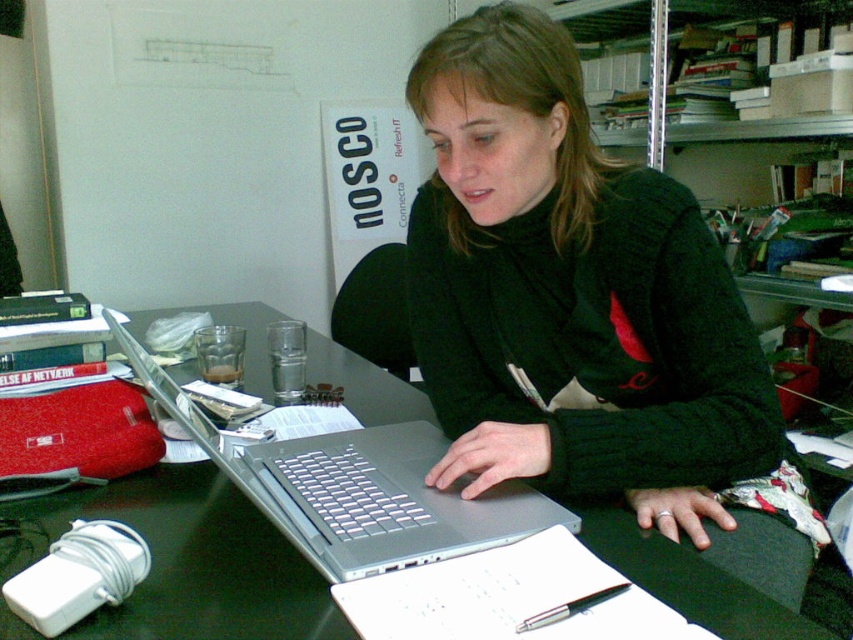
Please provide the coordinates of the metallic gray table at center in the image. The coordinates should be in the format of a point with two decimal places, like this example format. Please ensure your answer strictly follows the format without any additional text or explanation.

The coordinates of the metallic gray table at center are at point [189,561].

Where is the black matte sweater at center located in the image?

The black matte sweater at center is located at point (587, 314) in the image.

You are a fashion designer observing the scene. You need to determine if the black matte sweater at center can be placed on top of the silver metallic laptop at center without covering its entire surface. Can you confirm this?

The black matte sweater at center has a smaller width than the silver metallic laptop at center. Therefore, placing the black matte sweater at center on top of the silver metallic laptop at center would leave parts of the laptop visible, as the sweater is narrower.